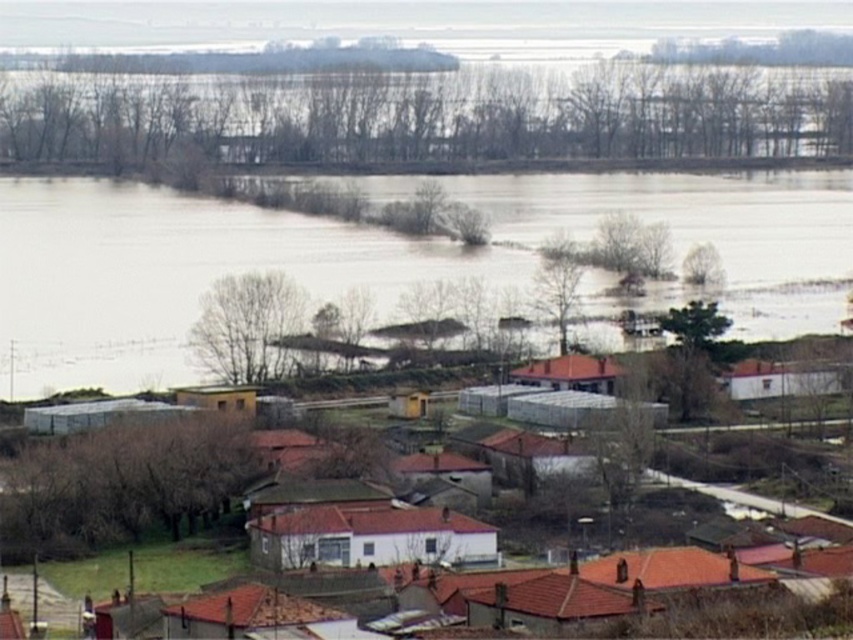
Question: Does brown muddy water at center have a lesser width compared to white matte building at center?

Choices:
 (A) yes
 (B) no

Answer: (B)

Question: Which object is farther from the camera taking this photo?

Choices:
 (A) brown muddy water at center
 (B) white matte building at center

Answer: (A)

Question: Does brown muddy water at center have a larger size compared to white matte building at center?

Choices:
 (A) no
 (B) yes

Answer: (B)

Question: Is brown muddy water at center further to the viewer compared to white matte building at center?

Choices:
 (A) no
 (B) yes

Answer: (B)